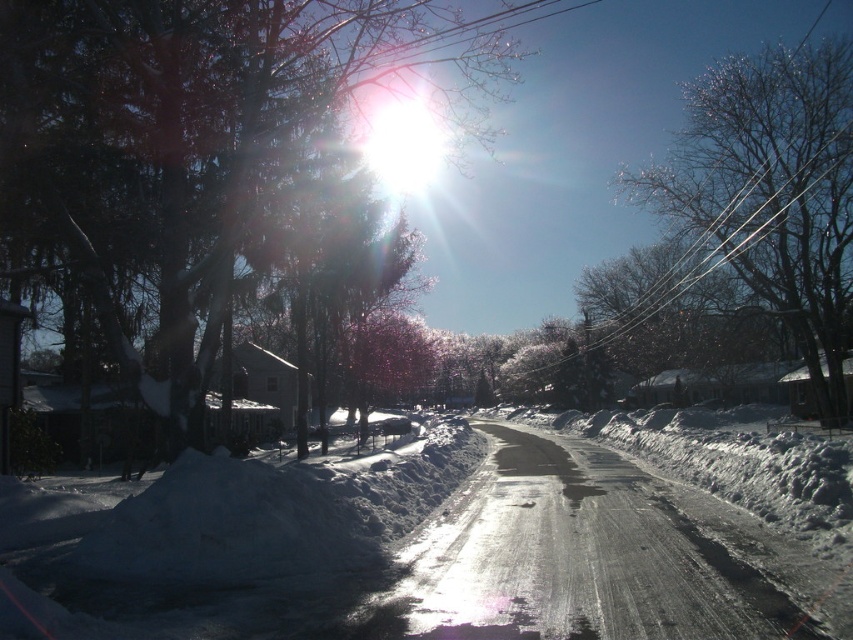
Which of these two, snow-covered tree at upper center or bare branches at upper right, stands shorter?

bare branches at upper right

Between snow-covered tree at upper center and bare branches at upper right, which one is positioned lower?

bare branches at upper right is lower down.

Which is behind, point (479, 86) or point (779, 225)?

The point (479, 86) is more distant.

You are a GUI agent. You are given a task and a screenshot of the screen. Output one action in this format:
    pyautogui.click(x=<x>, y=<y>)
    Task: Click on the snow-covered tree at upper center
    
    Given the screenshot: What is the action you would take?
    point(196,145)

Is white powdery snow at center further to the viewer compared to snow-covered tree at upper center?

No, it is in front of snow-covered tree at upper center.

Which is above, white powdery snow at center or snow-covered tree at upper center?

snow-covered tree at upper center is above.

You are a GUI agent. You are given a task and a screenshot of the screen. Output one action in this format:
    pyautogui.click(x=<x>, y=<y>)
    Task: Click on the white powdery snow at center
    
    Given the screenshot: What is the action you would take?
    pyautogui.click(x=408, y=552)

Does white powdery snow at center have a smaller size compared to bare branches at upper right?

Indeed, white powdery snow at center has a smaller size compared to bare branches at upper right.

Which is in front, point (560, 497) or point (773, 116)?

Point (560, 497)

The height and width of the screenshot is (640, 853). I want to click on white powdery snow at center, so click(x=408, y=552).